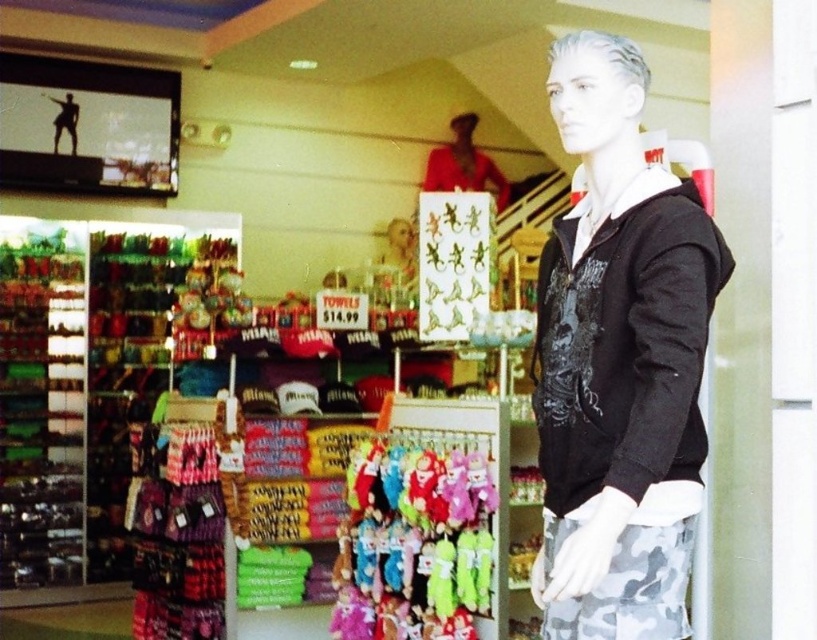
You are a customer in the store and want to buy a souvenir. You notice the black matte hoodie at center and the matte red shirt at upper center. Which one do you think is smaller in size?

The black matte hoodie at center has a smaller size compared to the matte red shirt at upper center, so the black matte hoodie at center is smaller.

You are a customer in the store and want to know if the black matte hoodie at center can fit into the shopping bag you have, which can hold items up to the width of the matte red shirt at upper center. Can it fit?

The black matte hoodie at center has a width less than the matte red shirt at upper center, so it will fit into the shopping bag designed to hold items up to the width of the matte red shirt at upper center.